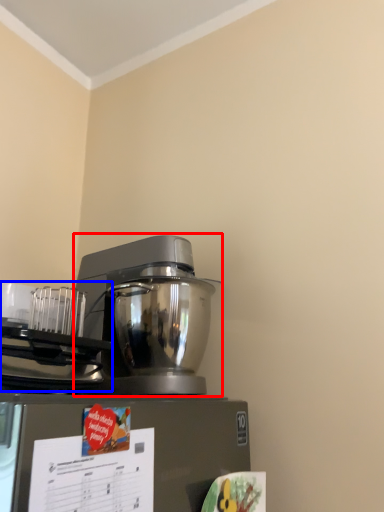
Question: Which object appears closest to the camera in this image, mixer (highlighted by a red box) or appliance (highlighted by a blue box)?

Choices:
 (A) mixer
 (B) appliance

Answer: (B)